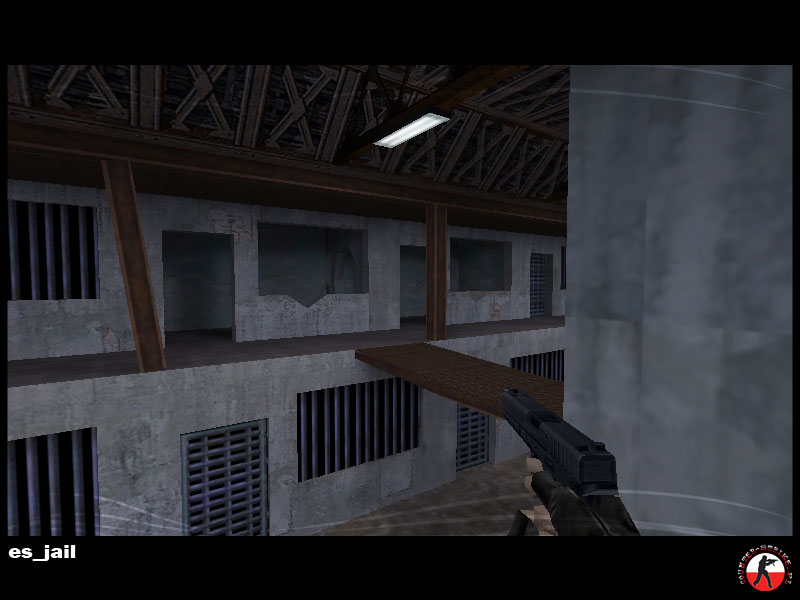
Where is `light`? This screenshot has width=800, height=600. light is located at coordinates (412, 129).